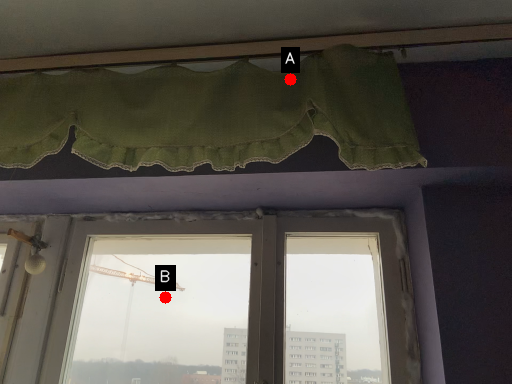
Question: Two points are circled on the image, labeled by A and B beside each circle. Which of the following is the farthest from the observer?

Choices:
 (A) A is further
 (B) B is further

Answer: (B)